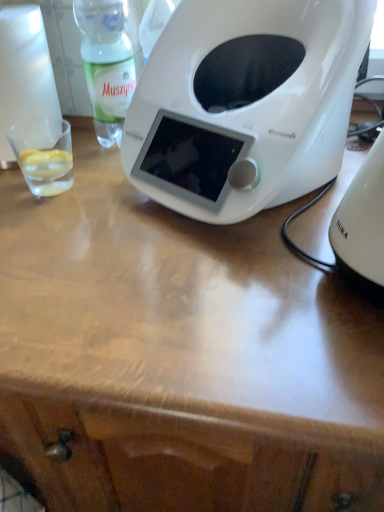
Question: Is the depth of green translucent bottle at upper left less than that of white paper towel at left?

Choices:
 (A) yes
 (B) no

Answer: (B)

Question: Does green translucent bottle at upper left appear on the left side of white paper towel at left?

Choices:
 (A) yes
 (B) no

Answer: (B)

Question: Is white paper towel at left inside green translucent bottle at upper left?

Choices:
 (A) no
 (B) yes

Answer: (A)

Question: Is green translucent bottle at upper left turned away from white paper towel at left?

Choices:
 (A) no
 (B) yes

Answer: (A)

Question: Is green translucent bottle at upper left further to the viewer compared to white paper towel at left?

Choices:
 (A) yes
 (B) no

Answer: (A)

Question: Looking at their shapes, would you say transparent glass at left is wider or thinner than green translucent bottle at upper left?

Choices:
 (A) wide
 (B) thin

Answer: (B)

Question: From the image's perspective, is transparent glass at left located above or below green translucent bottle at upper left?

Choices:
 (A) above
 (B) below

Answer: (B)

Question: From a real-world perspective, is transparent glass at left above or below green translucent bottle at upper left?

Choices:
 (A) above
 (B) below

Answer: (B)

Question: Is point (46, 164) closer or farther from the camera than point (119, 18)?

Choices:
 (A) closer
 (B) farther

Answer: (A)

Question: Considering the relative positions of white plastic kettle at right and white plastic toaster at center in the image provided, is white plastic kettle at right to the left or to the right of white plastic toaster at center?

Choices:
 (A) left
 (B) right

Answer: (B)

Question: From a real-world perspective, is white plastic kettle at right physically located above or below white plastic toaster at center?

Choices:
 (A) above
 (B) below

Answer: (B)

Question: From the image's perspective, is white plastic kettle at right positioned above or below white plastic toaster at center?

Choices:
 (A) below
 (B) above

Answer: (A)

Question: Is white plastic kettle at right taller or shorter than white plastic toaster at center?

Choices:
 (A) short
 (B) tall

Answer: (A)

Question: Is white paper towel at left to the left or to the right of green translucent bottle at upper left in the image?

Choices:
 (A) right
 (B) left

Answer: (B)

Question: From their relative heights in the image, would you say white paper towel at left is taller or shorter than green translucent bottle at upper left?

Choices:
 (A) short
 (B) tall

Answer: (A)